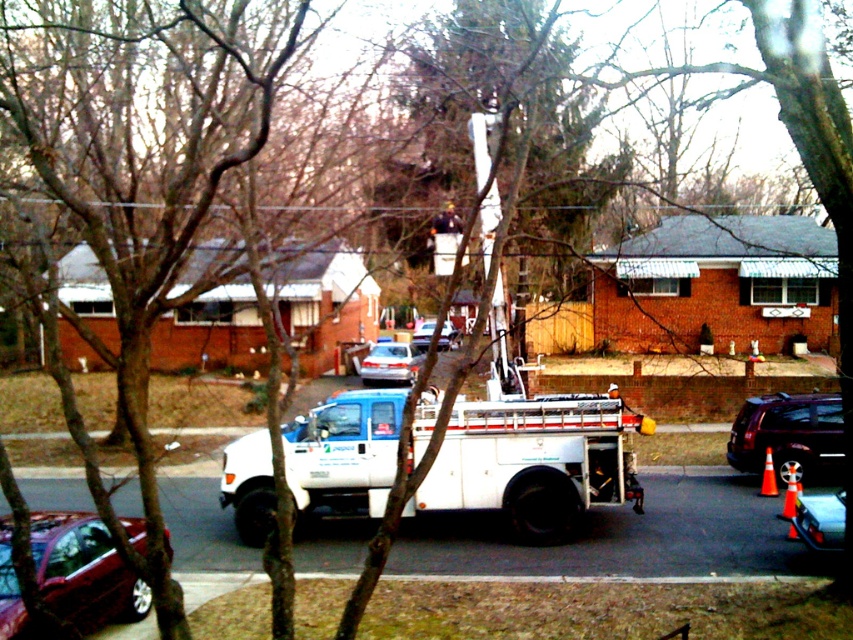
Question: Is shiny black suv at right to the right of silver metallic sedan at center from the viewer's perspective?

Choices:
 (A) yes
 (B) no

Answer: (A)

Question: Can you confirm if white matte utility truck at center is positioned above shiny black suv at right?

Choices:
 (A) yes
 (B) no

Answer: (A)

Question: Which of the following is the closest to the observer?

Choices:
 (A) white matte utility truck at center
 (B) satin silver sedan at center
 (C) white metallic utility truck at center

Answer: (A)

Question: Is shiny black suv at right further to the viewer compared to satin silver sedan at center?

Choices:
 (A) yes
 (B) no

Answer: (B)

Question: Which of the following is the farthest from the observer?

Choices:
 (A) white matte utility truck at center
 (B) metallic silver car at lower right
 (C) shiny black suv at right

Answer: (C)

Question: Based on their relative distances, which object is nearer to the white metallic utility truck at center?

Choices:
 (A) white matte utility truck at center
 (B) silver metallic sedan at center

Answer: (A)